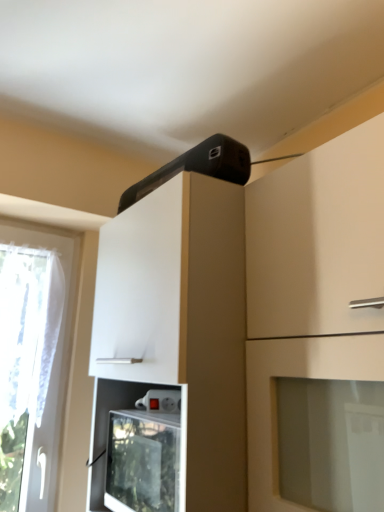
Question: Is black plastic speaker at upper center not inside white glossy cabinet at upper center, the first cabinetry positioned from the left?

Choices:
 (A) yes
 (B) no

Answer: (A)

Question: Is black plastic speaker at upper center at the left side of white glossy cabinet at upper center, the first cabinetry positioned from the left?

Choices:
 (A) yes
 (B) no

Answer: (A)

Question: From the image's perspective, does black plastic speaker at upper center appear lower than white glossy cabinet at upper center, the first cabinetry positioned from the left?

Choices:
 (A) yes
 (B) no

Answer: (B)

Question: Are black plastic speaker at upper center and white glossy cabinet at upper center, the first cabinetry positioned from the left, far apart?

Choices:
 (A) no
 (B) yes

Answer: (A)

Question: Is black plastic speaker at upper center directly adjacent to white glossy cabinet at upper center, the second cabinetry positioned from the right?

Choices:
 (A) no
 (B) yes

Answer: (A)

Question: Does black plastic speaker at upper center have a larger size compared to white glossy cabinet at upper center, the first cabinetry positioned from the left?

Choices:
 (A) no
 (B) yes

Answer: (A)

Question: Does black plastic speaker at upper center lie in front of white glossy cabinet at upper center, acting as the first cabinetry starting from the right?

Choices:
 (A) yes
 (B) no

Answer: (B)

Question: Does black plastic speaker at upper center turn towards white glossy cabinet at upper center, the second cabinetry in the left-to-right sequence?

Choices:
 (A) no
 (B) yes

Answer: (A)

Question: Considering the relative positions of black plastic speaker at upper center and white glossy cabinet at upper center, the second cabinetry in the left-to-right sequence, in the image provided, is black plastic speaker at upper center to the left of white glossy cabinet at upper center, the second cabinetry in the left-to-right sequence, from the viewer's perspective?

Choices:
 (A) yes
 (B) no

Answer: (A)

Question: Considering the relative sizes of black plastic speaker at upper center and white glossy cabinet at upper center, acting as the first cabinetry starting from the right, in the image provided, is black plastic speaker at upper center taller than white glossy cabinet at upper center, acting as the first cabinetry starting from the right,?

Choices:
 (A) no
 (B) yes

Answer: (A)

Question: Considering the relative sizes of black plastic speaker at upper center and white glossy cabinet at upper center, acting as the first cabinetry starting from the right, in the image provided, is black plastic speaker at upper center bigger than white glossy cabinet at upper center, acting as the first cabinetry starting from the right,?

Choices:
 (A) no
 (B) yes

Answer: (A)

Question: Can you confirm if black plastic speaker at upper center is thinner than white glossy cabinet at upper center, the second cabinetry in the left-to-right sequence?

Choices:
 (A) yes
 (B) no

Answer: (A)

Question: From the image's perspective, is white glossy cabinet at upper center, the second cabinetry positioned from the right, beneath black plastic speaker at upper center?

Choices:
 (A) no
 (B) yes

Answer: (B)